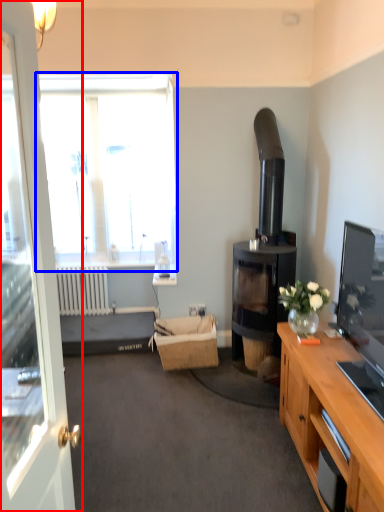
Question: Among these objects, which one is nearest to the camera, door (highlighted by a red box) or window (highlighted by a blue box)?

Choices:
 (A) door
 (B) window

Answer: (A)